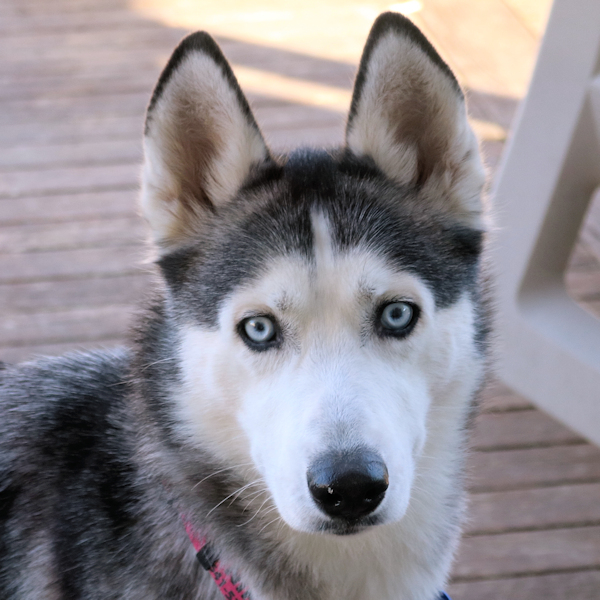
You are a GUI agent. You are given a task and a screenshot of the screen. Output one action in this format:
    pyautogui.click(x=<x>, y=<y>)
    Task: Click on the floor
    
    Given the screenshot: What is the action you would take?
    pyautogui.click(x=516, y=503)